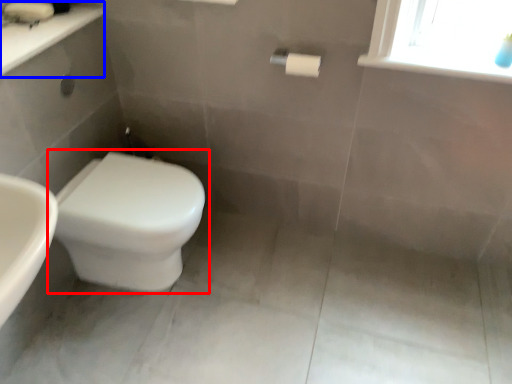
Question: Which of the following is the closest to the observer, toilet (highlighted by a red box) or counter top (highlighted by a blue box)?

Choices:
 (A) toilet
 (B) counter top

Answer: (B)